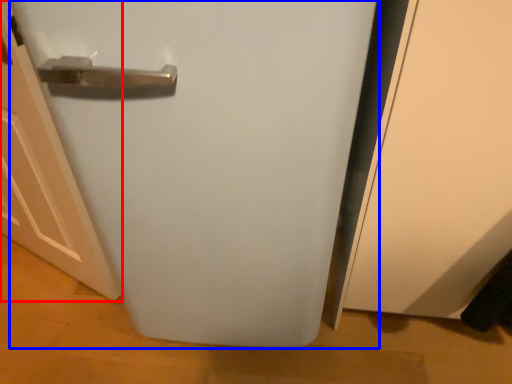
Question: Which point is further to the camera, door (highlighted by a red box) or refrigerator (highlighted by a blue box)?

Choices:
 (A) door
 (B) refrigerator

Answer: (A)